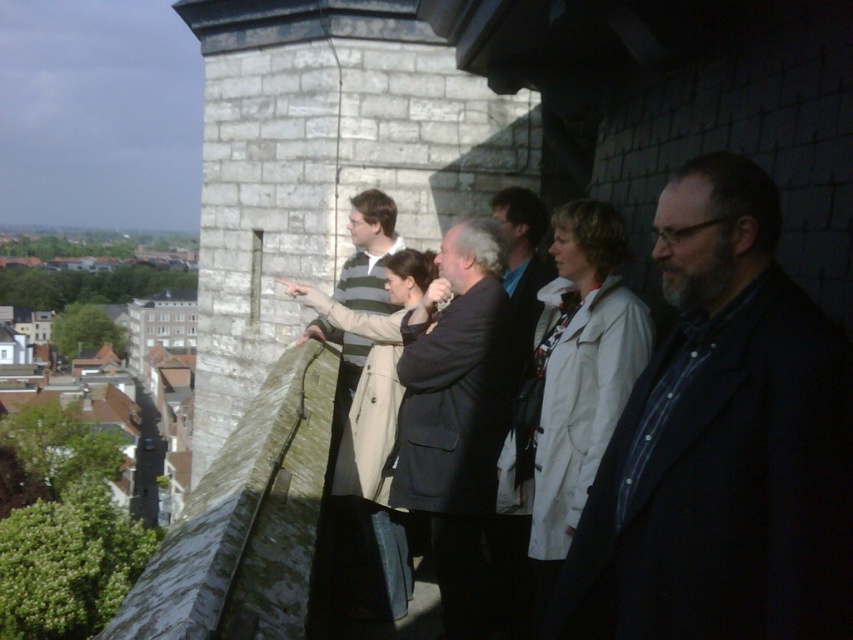
Question: Does dark blue shirt at center have a greater width compared to striped knit sweater at center?

Choices:
 (A) yes
 (B) no

Answer: (A)

Question: Which of these objects is positioned farthest from the dark blue shirt at center?

Choices:
 (A) dark gray wool coat at center
 (B) striped knit sweater at center

Answer: (B)

Question: Does dark gray wool coat at center come behind striped knit sweater at center?

Choices:
 (A) yes
 (B) no

Answer: (B)

Question: Can you confirm if dark blue shirt at center is thinner than striped knit sweater at center?

Choices:
 (A) no
 (B) yes

Answer: (A)

Question: Which point is farther to the camera?

Choices:
 (A) (634, 493)
 (B) (412, 381)
 (C) (344, 369)

Answer: (C)

Question: Which object is farther from the camera taking this photo?

Choices:
 (A) striped knit sweater at center
 (B) dark blue shirt at center

Answer: (A)